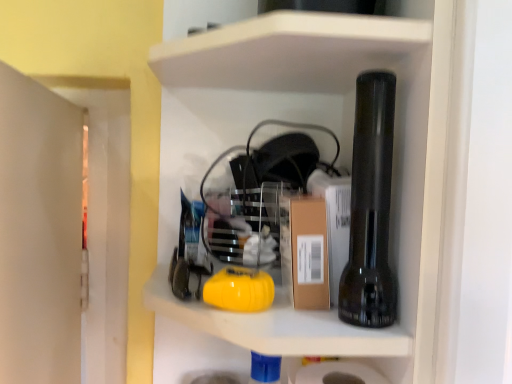
Question: Can we say black matte beer bottle at right lies outside brown cardboard box at center?

Choices:
 (A) yes
 (B) no

Answer: (A)

Question: From a real-world perspective, is black matte beer bottle at right under brown cardboard box at center?

Choices:
 (A) yes
 (B) no

Answer: (B)

Question: Can you confirm if black matte beer bottle at right is shorter than brown cardboard box at center?

Choices:
 (A) no
 (B) yes

Answer: (A)

Question: Considering the relative positions of black matte beer bottle at right and brown cardboard box at center in the image provided, is black matte beer bottle at right to the right of brown cardboard box at center from the viewer's perspective?

Choices:
 (A) no
 (B) yes

Answer: (B)

Question: Is black matte beer bottle at right wider than brown cardboard box at center?

Choices:
 (A) yes
 (B) no

Answer: (A)

Question: From a real-world perspective, does black matte beer bottle at right stand above brown cardboard box at center?

Choices:
 (A) yes
 (B) no

Answer: (A)

Question: Is brown cardboard box at center taller than black matte beer bottle at right?

Choices:
 (A) yes
 (B) no

Answer: (B)

Question: Could you tell me if brown cardboard box at center is facing black matte beer bottle at right?

Choices:
 (A) yes
 (B) no

Answer: (B)

Question: Would you say brown cardboard box at center contains black matte beer bottle at right?

Choices:
 (A) no
 (B) yes

Answer: (A)

Question: From the image's perspective, does brown cardboard box at center appear higher than black matte beer bottle at right?

Choices:
 (A) no
 (B) yes

Answer: (A)

Question: Can you confirm if brown cardboard box at center is smaller than black matte beer bottle at right?

Choices:
 (A) no
 (B) yes

Answer: (B)

Question: From a real-world perspective, is brown cardboard box at center positioned under black matte beer bottle at right based on gravity?

Choices:
 (A) no
 (B) yes

Answer: (B)

Question: In terms of size, does brown cardboard box at center appear bigger or smaller than black matte beer bottle at right?

Choices:
 (A) small
 (B) big

Answer: (A)